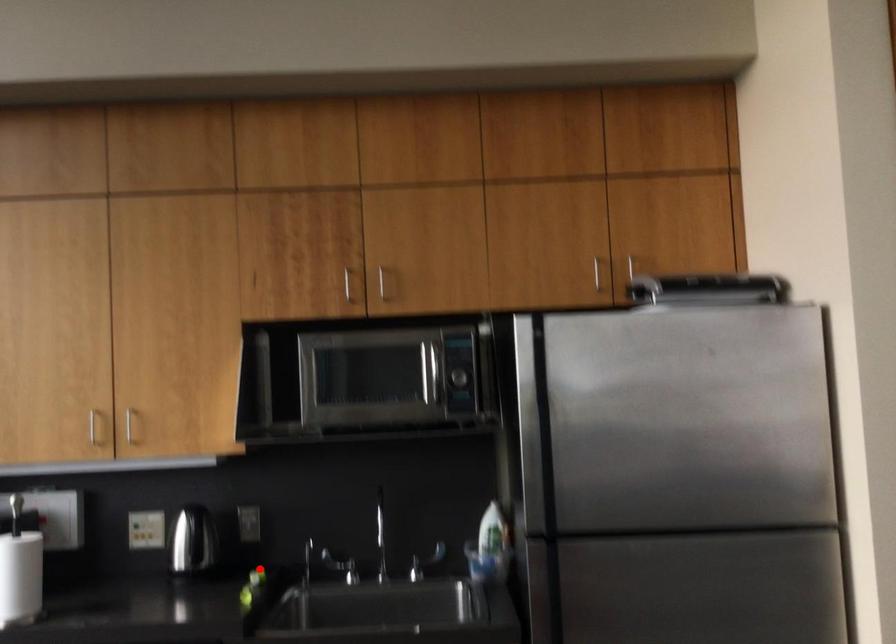
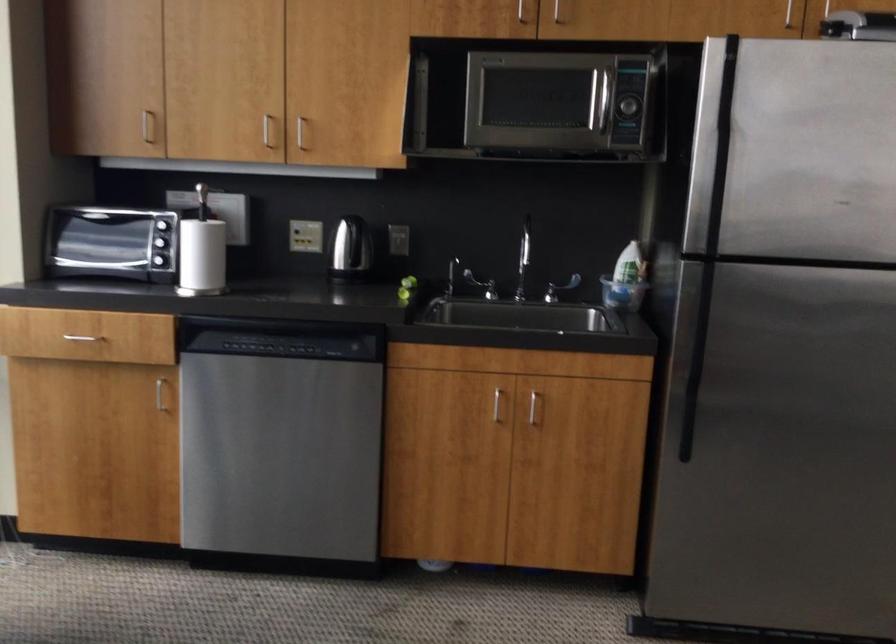
Where in the second image is the point corresponding to the highlighted location from the first image?

(409, 281)